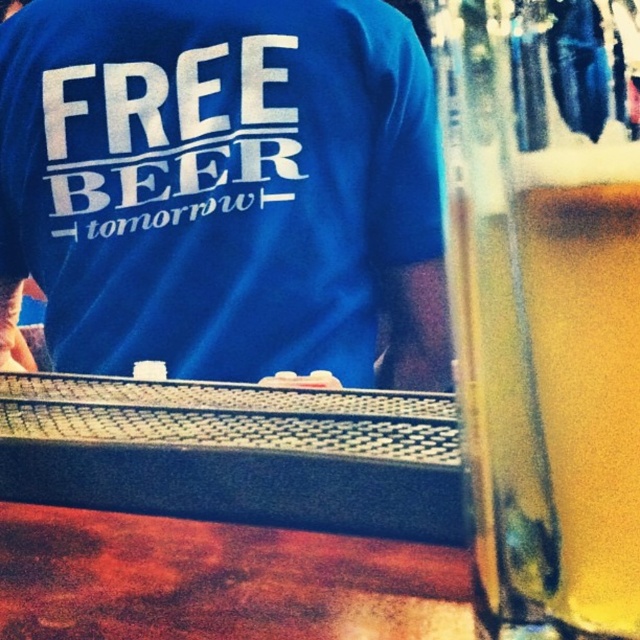
Looking at this image, does blue cotton t-shirt at upper left have a lesser width compared to translucent glass beer at right?

No, blue cotton t-shirt at upper left is not thinner than translucent glass beer at right.

Is blue cotton t-shirt at upper left positioned before translucent glass beer at right?

No.

Does point (385, 122) come closer to viewer compared to point (550, 99)?

No, (385, 122) is further to viewer.

Where is `blue cotton t-shirt at upper left`? Image resolution: width=640 pixels, height=640 pixels. blue cotton t-shirt at upper left is located at coordinates (230, 198).